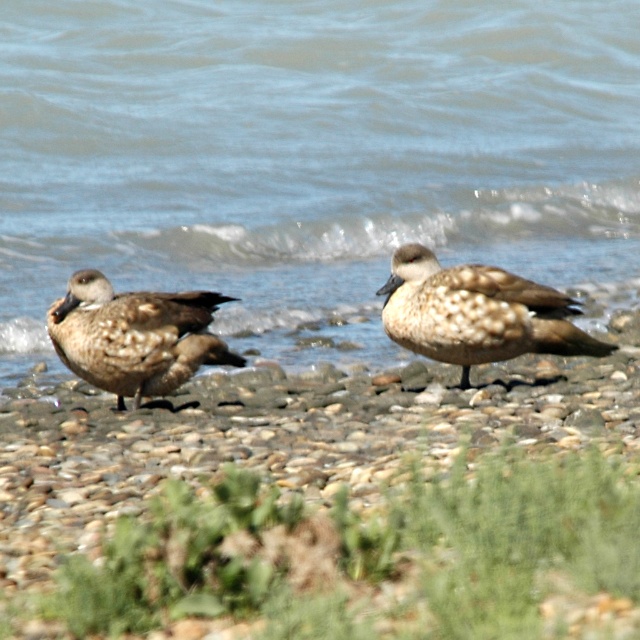
Question: Among these objects, which one is farthest from the camera?

Choices:
 (A) brown speckled duck at left
 (B) blue water at center
 (C) speckled feathered duck at center

Answer: (B)

Question: Among these objects, which one is farthest from the camera?

Choices:
 (A) brown speckled duck at left
 (B) speckled feathered duck at center
 (C) speckled stone pebbles at center

Answer: (B)

Question: Is speckled stone pebbles at center to the left of brown speckled duck at left from the viewer's perspective?

Choices:
 (A) no
 (B) yes

Answer: (A)

Question: Is speckled stone pebbles at center thinner than brown speckled duck at left?

Choices:
 (A) no
 (B) yes

Answer: (A)

Question: Which of the following is the closest to the observer?

Choices:
 (A) brown speckled duck at left
 (B) speckled stone pebbles at center
 (C) blue water at center
 (D) speckled feathered duck at center

Answer: (B)

Question: Does speckled stone pebbles at center appear under speckled feathered duck at center?

Choices:
 (A) yes
 (B) no

Answer: (A)